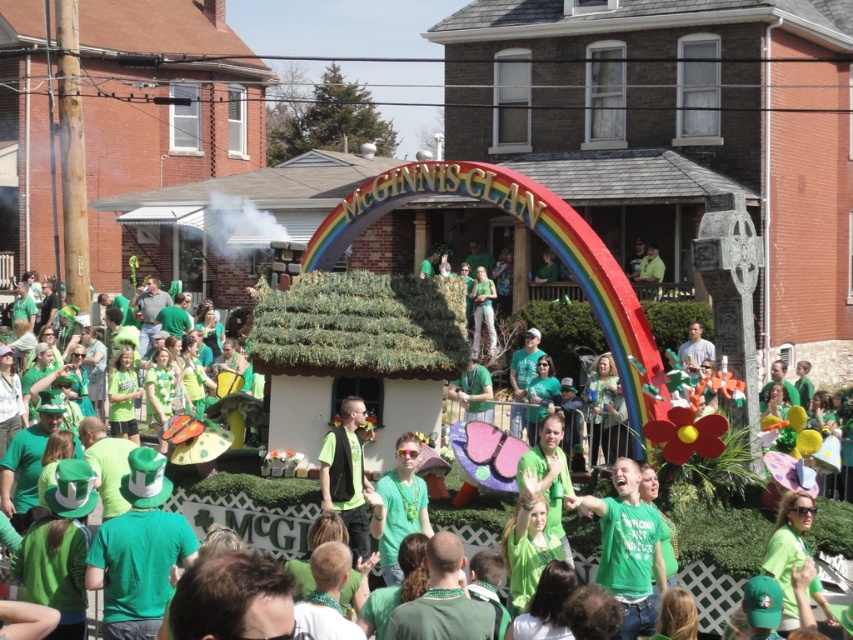
You are a photographer standing at the edge of the St. Patrick Day parade crowd. You want to capture a photo of the matte green float at center without any obstructions. Based on your position, is the point at coordinates point (248, 515) directly in front of the matte green float at center? Please answer yes or no.

Yes, the point at coordinates point (248, 515) corresponds to the matte green float at center, so it is directly in front of it.

You are a photographer at the St. Patrick Day parade. You want to capture a photo of the matte green float at center and the green matte vest at center in the same frame. Which object should you focus on first to ensure both are in the frame?

The matte green float at center is wider than the green matte vest at center, so you should focus on the matte green float at center first to ensure both are in the frame.

You are a photographer at the St. Patrick Day parade. You want to capture a photo of the matte green float at center and the green matte shirt at center in the same frame. Which object should you focus on first to ensure both are in the frame?

The matte green float at center is wider than the green matte shirt at center, so you should focus on the matte green float at center first to ensure both are in the frame.